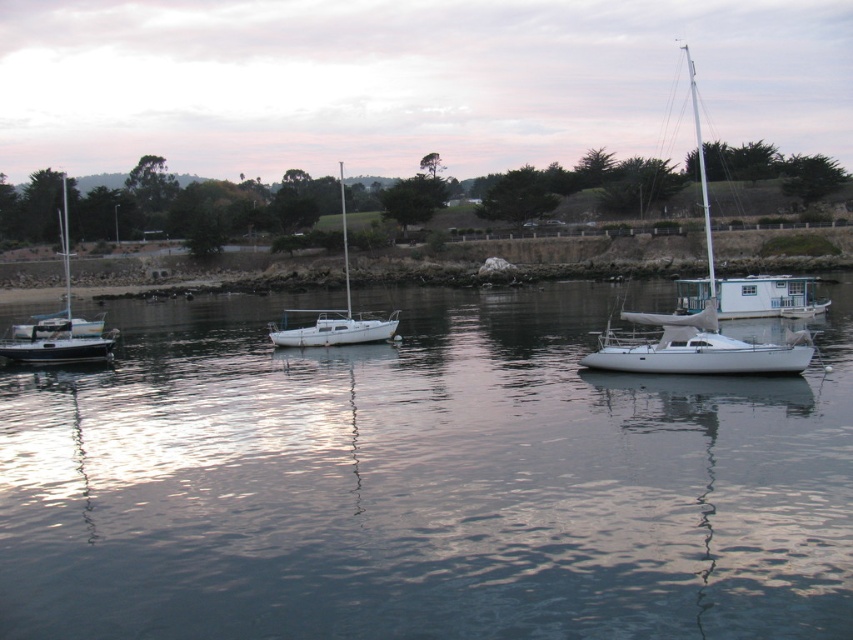
You are standing at the center of the image and want to locate the white matte sailboat at left. According to the coordinates provided, in which direction should you look to find it?

The white matte sailboat at left is located at coordinates point (x=59, y=323), which is to the left side of the image. Therefore, you should look to the left to find it.

Based on the photo, you are a photographer planning to take a photo of the waterfront scene. You want to ensure both the white glossy sailboat at right and the white matte sailboat at center are clearly visible. Given their sizes, which boat should you focus on first to ensure it fits within the frame?

The white glossy sailboat at right is bigger than the white matte sailboat at center, so you should focus on the white glossy sailboat at right first to ensure it fits within the frame.

You are standing on the dock and see the white glossy sailboat at right and the white matte sailboat at left. Which one is positioned farther to the east if the sun is setting in the west?

The white glossy sailboat at right is positioned farther to the east because it is to the right of the white matte sailboat at left, and since the sun is setting in the west, the right side of the image corresponds to the east direction.